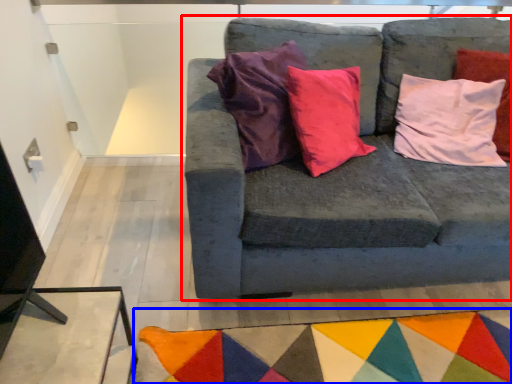
Question: Among these objects, which one is nearest to the camera, studio couch (highlighted by a red box) or mat (highlighted by a blue box)?

Choices:
 (A) studio couch
 (B) mat

Answer: (A)